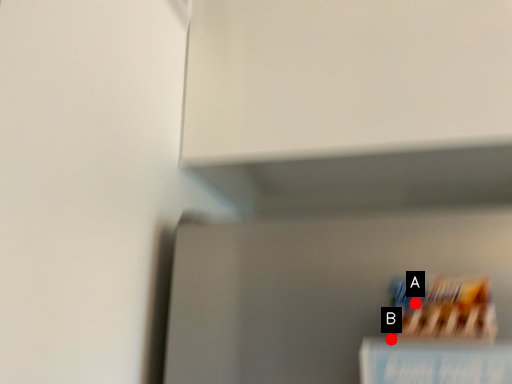
Question: Two points are circled on the image, labeled by A and B beside each circle. Which point is further to the camera?

Choices:
 (A) A is further
 (B) B is further

Answer: (B)